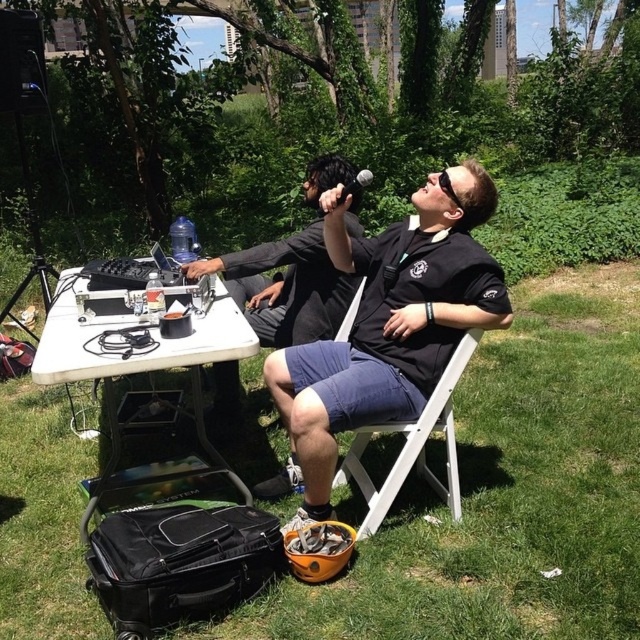
You are standing at the edge of the park scene and want to place a small speaker on the white plastic table at center. Based on the coordinates provided, can you confirm if the table is positioned in the central area of the image?

Yes, the white plastic table at center is located at coordinates point (138, 358), which places it in the central area of the image.

You are a photographer taking a picture of the scene. You need to ensure both the black matte microphone at upper center and the black rubber goggles at upper center are clearly visible. Since you want to focus on the wider object, which one should you adjust your camera settings for?

The black matte microphone at upper center is wider than the black rubber goggles at upper center. Therefore, you should adjust your camera settings to focus on the black matte microphone at upper center as it is the wider object.

You are a photographer taking a picture of the scene. The black matte shirt at center and the white plastic table at center are both in the frame. Which object should you focus on if you want to capture the taller object in the image?

The black matte shirt at center is taller than the white plastic table at center, so you should focus on the black matte shirt at center to capture the taller object.